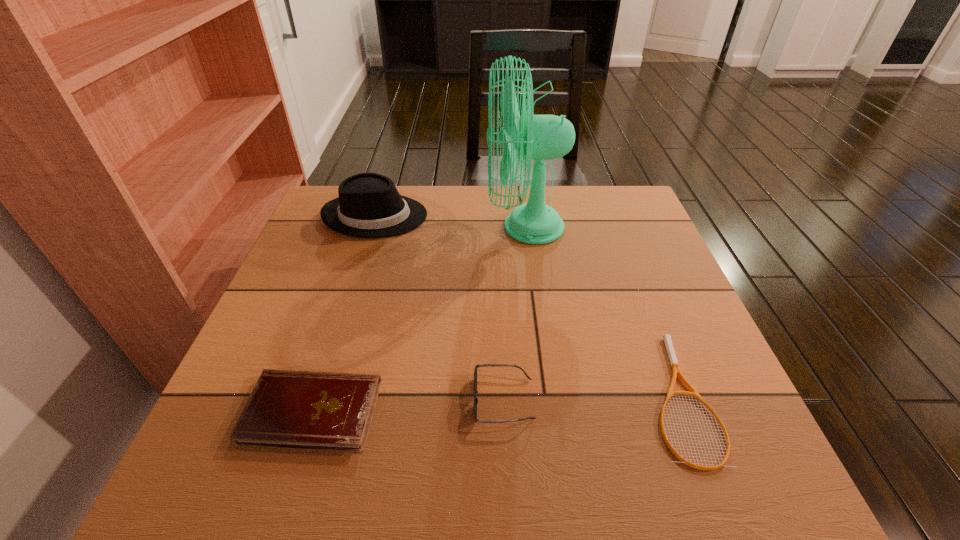
Locate an element on the screen. notebook present at the left edge is located at coordinates (309, 410).

You are a GUI agent. You are given a task and a screenshot of the screen. Output one action in this format:
    pyautogui.click(x=<x>, y=<y>)
    Task: Click on the object located in the right edge section of the desktop
    This screenshot has height=540, width=960.
    Given the screenshot: What is the action you would take?
    pyautogui.click(x=676, y=370)

This screenshot has height=540, width=960. Identify the location of object situated at the far left corner. (369, 205).

Find the location of a particular element. This screenshot has height=540, width=960. object at the near left corner is located at coordinates (309, 410).

At what (x,y) coordinates should I click in order to perform the action: click on object that is at the near right corner. Please return your answer as a coordinate pair (x, y). Looking at the image, I should click on click(676, 370).

In the image, there is a desktop. Where is `free region at the far edge`? free region at the far edge is located at coordinates (582, 218).

Identify the location of free space at the near edge of the desktop. (632, 479).

The width and height of the screenshot is (960, 540). In order to click on vacant space at the left edge of the desktop in this screenshot , I will do tap(324, 299).

In the image, there is a desktop. At what (x,y) coordinates should I click in order to perform the action: click on vacant space at the right edge. Please return your answer as a coordinate pair (x, y). This screenshot has height=540, width=960. Looking at the image, I should click on (649, 291).

Locate an element on the screen. vacant space at the near left corner of the desktop is located at coordinates (254, 489).